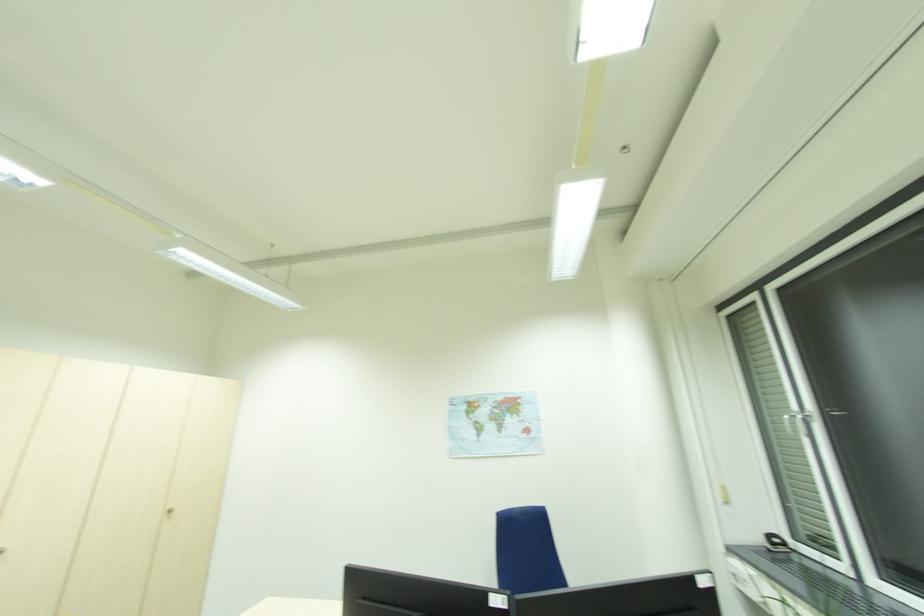
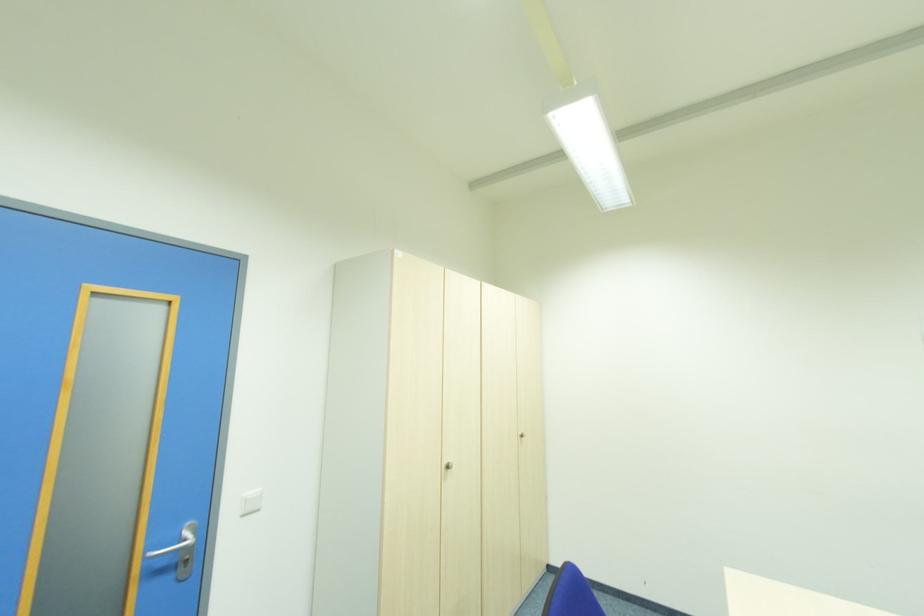
Question: In a continuous first-person perspective shot, in which direction is the camera moving?

Choices:
 (A) Left
 (B) Right
 (C) Forward
 (D) Backward

Answer: (A)